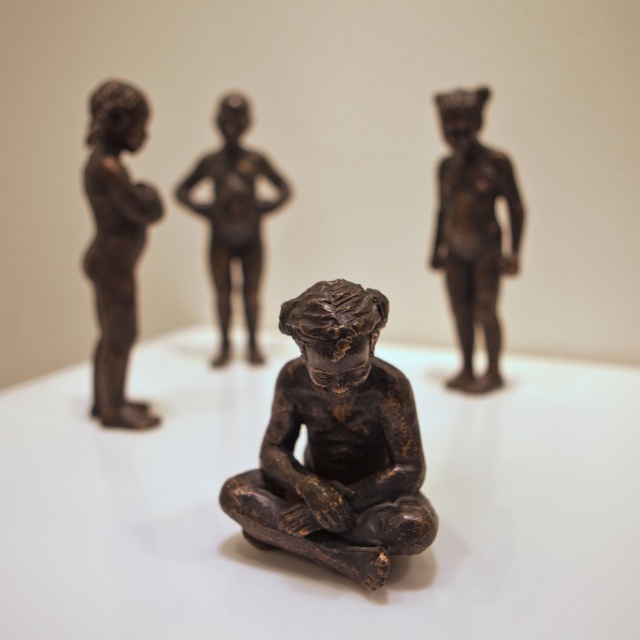
You are a museum curator standing 1.5 meters away from a display case containing the bronze statue at center. Can you comfortably view the statue without needing to move closer?

The bronze statue at center is 1.44 meters away from the viewer, so yes, the curator can comfortably view the statue from 1.5 meters away without needing to move closer since the statue is slightly closer than the curator is standing.

From the picture: You are an art curator arranging a display. You notice the bronze statue at center and the bronze statue at upper right. Which one is positioned lower in the image?

The bronze statue at center is located below the bronze statue at upper right, so it is positioned lower in the image.

You are an art curator arranging an exhibition. You notice the bronze statue at left and the matte bronze figure at center in the image. Which object is positioned to the left side of the other?

The bronze statue at left is positioned to the left of the matte bronze figure at center.